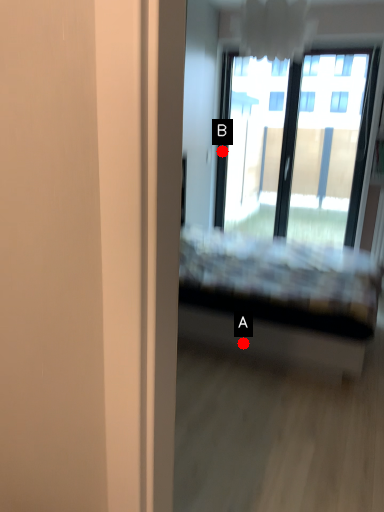
Question: Two points are circled on the image, labeled by A and B beside each circle. Which point appears farthest from the camera in this image?

Choices:
 (A) A is further
 (B) B is further

Answer: (B)